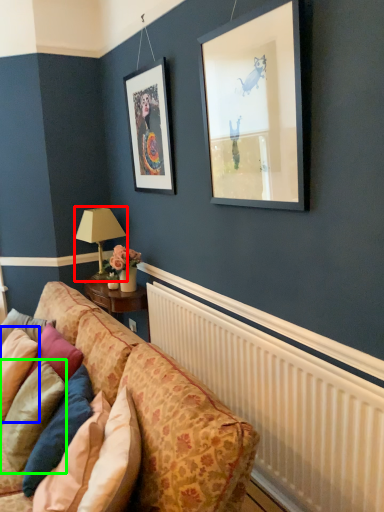
Question: Estimate the real-world distances between objects in this image. Which object is closer to table lamp (highlighted by a red box), pillow (highlighted by a blue box) or pillow (highlighted by a green box)?

Choices:
 (A) pillow
 (B) pillow

Answer: (A)